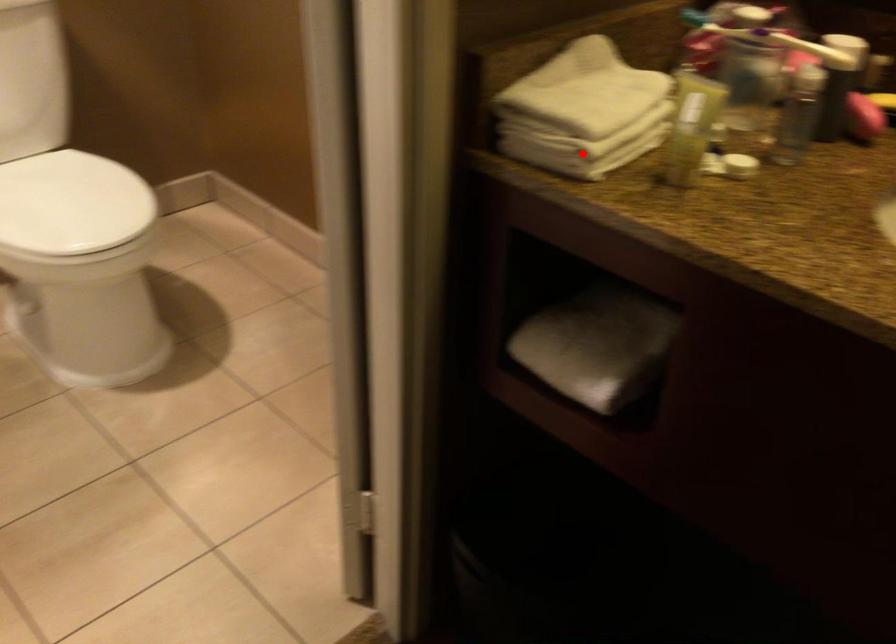
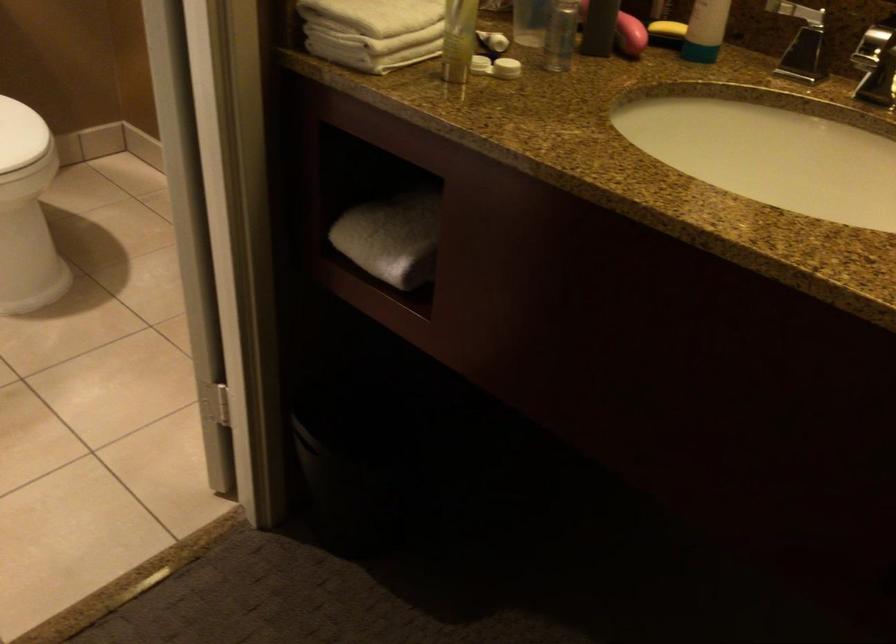
Question: I am providing you with two images of the same scene from different viewpoints. A red point is shown in image1. For the corresponding object point in image2, is it positioned nearer or farther from the camera?

Choices:
 (A) Nearer
 (B) Farther

Answer: (B)